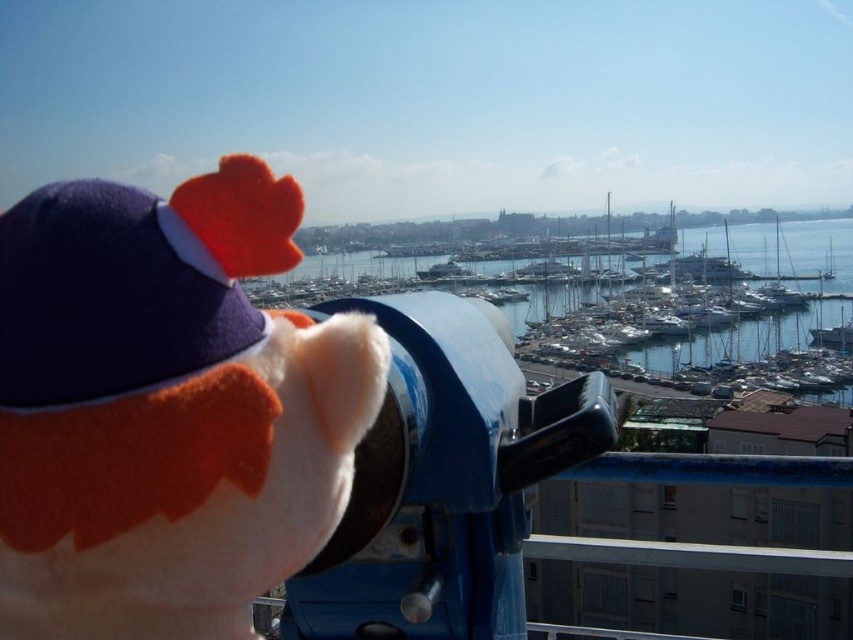
Question: In this image, where is white plush toy at center located relative to blue water at center?

Choices:
 (A) left
 (B) right

Answer: (A)

Question: Among these objects, which one is nearest to the camera?

Choices:
 (A) blue water at center
 (B) white plush toy at center
 (C) blue metallic telescope at center

Answer: (B)

Question: Which object appears farthest from the camera in this image?

Choices:
 (A) blue water at center
 (B) blue metallic telescope at center
 (C) white plush toy at center

Answer: (A)

Question: Considering the relative positions of white plush toy at center and blue water at center in the image provided, where is white plush toy at center located with respect to blue water at center?

Choices:
 (A) left
 (B) right

Answer: (A)

Question: Is white plush toy at center above blue water at center?

Choices:
 (A) yes
 (B) no

Answer: (B)

Question: Which object is positioned closest to the blue water at center?

Choices:
 (A) white plush toy at center
 (B) blue metallic telescope at center

Answer: (B)